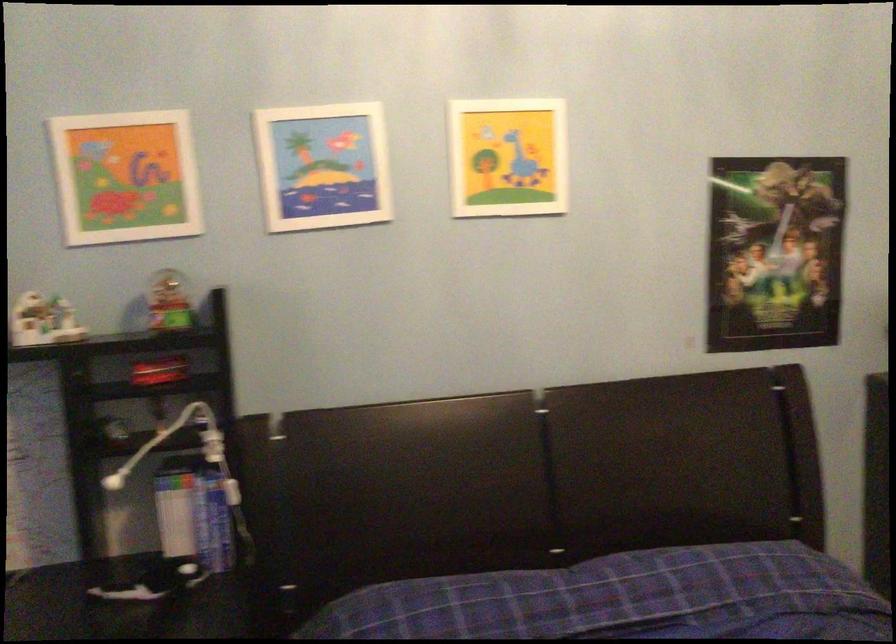
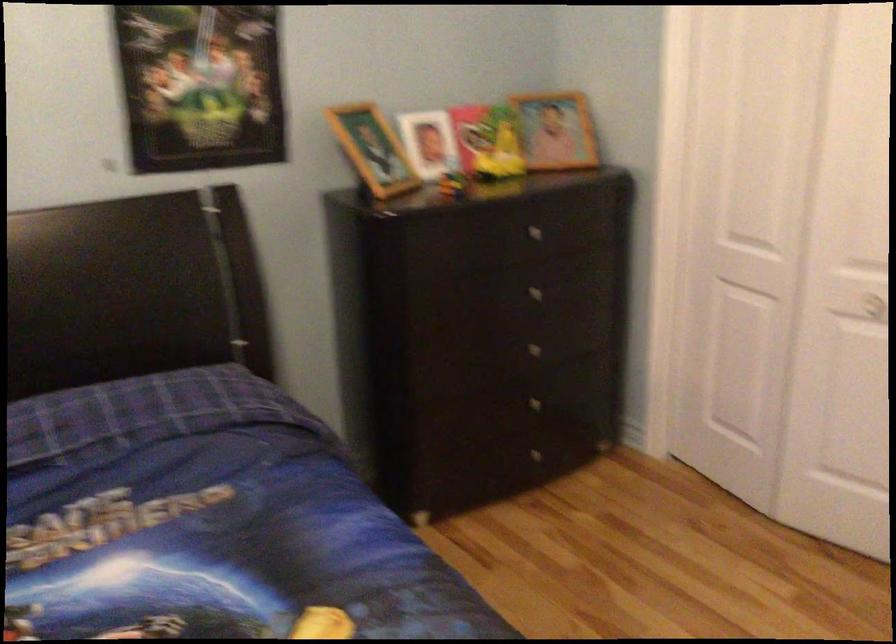
Question: What movement of the cameraman would produce the second image?

Choices:
 (A) Left
 (B) Right
 (C) Forward
 (D) Backward

Answer: (B)